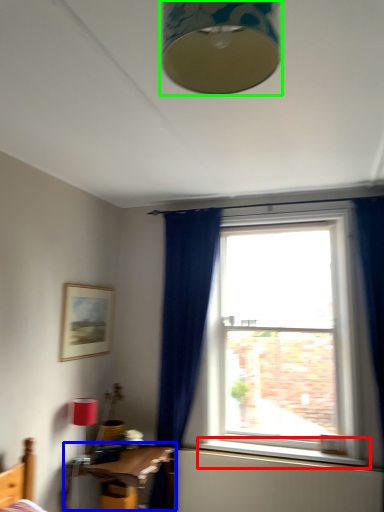
Question: Considering the real-world distances, which object is closest to window sill (highlighted by a red box)? table (highlighted by a blue box) or lamp (highlighted by a green box).

Choices:
 (A) table
 (B) lamp

Answer: (A)